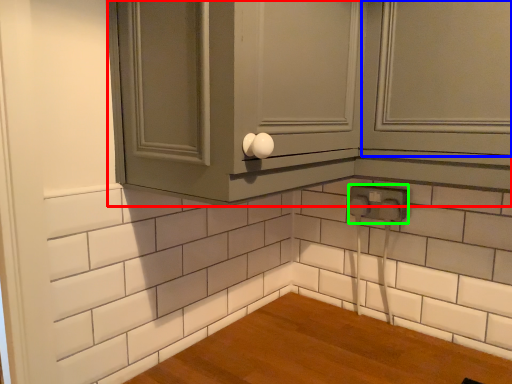
Question: Which object is the farthest from cabinetry (highlighted by a red box)? Choose among these: window (highlighted by a blue box) or electric outlet (highlighted by a green box).

Choices:
 (A) window
 (B) electric outlet

Answer: (B)